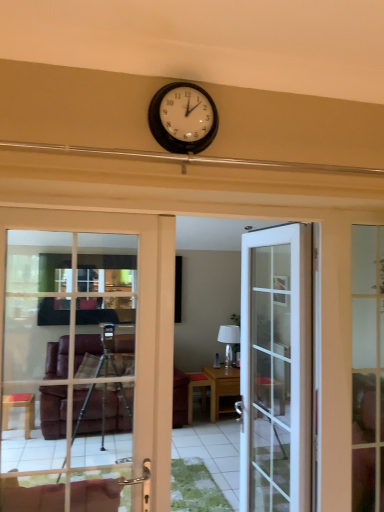
Locate an element on the screen. Image resolution: width=384 pixels, height=512 pixels. matte glass door at right is located at coordinates (367, 368).

I want to click on matte black clock at upper center, so click(183, 118).

Find the location of `wooden table at center, the 1th table from the right`. wooden table at center, the 1th table from the right is located at coordinates (222, 387).

The image size is (384, 512). What are the coordinates of `white glossy lamp at center` in the screenshot? It's located at (229, 340).

Considering the relative positions of white glossy lamp at center and wooden table at center, which appears as the first table when viewed from the left, in the image provided, is white glossy lamp at center in front of wooden table at center, which appears as the first table when viewed from the left,?

That is False.

Locate an element on the screen. lamp behind the wooden table at center, placed as the second table when sorted from right to left is located at coordinates (229, 340).

Can you confirm if white glossy lamp at center is shorter than wooden table at center, which appears as the first table when viewed from the left?

In fact, white glossy lamp at center may be taller than wooden table at center, which appears as the first table when viewed from the left.

In terms of width, does white glossy lamp at center look wider or thinner when compared to wooden table at center, which appears as the first table when viewed from the left?

In the image, white glossy lamp at center appears to be more narrow than wooden table at center, which appears as the first table when viewed from the left.

Could you tell me if white glass door at center, which is the 2th door from left to right, is facing white glossy lamp at center?

No, white glass door at center, which is the 2th door from left to right, does not turn towards white glossy lamp at center.

Between white glass door at center, which is the 1th door in back-to-front order, and white glossy lamp at center, which one appears on the right side from the viewer's perspective?

From the viewer's perspective, white glossy lamp at center appears more on the right side.

Between white glass door at center, which is the 2th door from left to right, and white glossy lamp at center, which one has more height?

white glass door at center, which is the 2th door from left to right, is taller.

Is point (274, 263) behind point (229, 366)?

No, it is not.

Could you tell me if white glossy lamp at center is facing matte black clock at upper center?

No, white glossy lamp at center does not turn towards matte black clock at upper center.

Considering the sizes of white glossy lamp at center and matte black clock at upper center in the image, is white glossy lamp at center taller or shorter than matte black clock at upper center?

Considering their sizes, white glossy lamp at center has more height than matte black clock at upper center.

Is white glossy lamp at center positioned behind matte black clock at upper center?

Yes, white glossy lamp at center is behind matte black clock at upper center.

How far apart are white glass door at center, which is the 1th door in back-to-front order, and matte black clock at upper center?

white glass door at center, which is the 1th door in back-to-front order, is 1.21 meters away from matte black clock at upper center.

Is white glass door at center, the 2th door viewed from the front, to the left of matte black clock at upper center from the viewer's perspective?

No, white glass door at center, the 2th door viewed from the front, is not to the left of matte black clock at upper center.

Considering the positions of objects white glass door at center, which is counted as the 1th door, starting from the right, and matte black clock at upper center in the image provided, who is behind, white glass door at center, which is counted as the 1th door, starting from the right, or matte black clock at upper center?

white glass door at center, which is counted as the 1th door, starting from the right.

Is matte black clock at upper center at the back of white glass door at center, the 2th door viewed from the front?

That's not correct — white glass door at center, the 2th door viewed from the front, is not looking away from matte black clock at upper center.

Considering the relative positions of matte black clock at upper center and white glass door at center, which is the 2th door from left to right, in the image provided, is matte black clock at upper center to the left or to the right of white glass door at center, which is the 2th door from left to right,?

matte black clock at upper center is to the left of white glass door at center, which is the 2th door from left to right.

Looking at their sizes, would you say matte black clock at upper center is wider or thinner than white glass door at center, which is the 2th door from left to right?

Considering their sizes, matte black clock at upper center looks slimmer than white glass door at center, which is the 2th door from left to right.

Is white glass door at center, which is the 2th door from left to right, completely or partially inside matte black clock at upper center?

No, white glass door at center, which is the 2th door from left to right, is not a part of matte black clock at upper center.

Identify the location of lamp that appears on the right of matte black clock at upper center. (229, 340).

Is matte black clock at upper center wider than white glossy lamp at center?

No.

Considering the points (202, 109) and (230, 355), which point is in front, point (202, 109) or point (230, 355)?

Point (202, 109)

Would you say wooden table at center, placed as the second table when sorted from right to left, is outside matte black clock at upper center?

Yes.

Can you confirm if wooden table at center, placed as the second table when sorted from right to left, is positioned to the right of matte black clock at upper center?

Yes.

Considering the sizes of objects wooden table at center, placed as the second table when sorted from right to left, and matte black clock at upper center in the image provided, who is smaller, wooden table at center, placed as the second table when sorted from right to left, or matte black clock at upper center?

matte black clock at upper center is smaller.

From the image's perspective, between wooden table at center, placed as the second table when sorted from right to left, and matte black clock at upper center, which one is located above?

matte black clock at upper center appears higher in the image.

This screenshot has height=512, width=384. I want to click on table that is the 2nd one when counting leftward from the white glossy lamp at center, so click(201, 393).

The width and height of the screenshot is (384, 512). In order to click on lamp that appears below the white glass door at center, which is counted as the 1th door, starting from the right (from the image's perspective) in this screenshot , I will do [x=229, y=340].

Consider the image. Estimate the real-world distances between objects in this image. Which object is further from white glossy lamp at center, wooden table at center, which appears as the first table when viewed from the left, or wooden table at center, positioned as the second table in left-to-right order?

The object further to white glossy lamp at center is wooden table at center, which appears as the first table when viewed from the left.

When comparing their distances from matte black clock at upper center, does white glass door at center, which is the 2th door from left to right, or white glass door at left, which is the second door in back-to-front order, seem closer?

The object closer to matte black clock at upper center is white glass door at left, which is the second door in back-to-front order.

Looking at the image, which one is located further to wooden table at center, placed as the second table when sorted from right to left, wooden table at center, the 1th table from the right, or white glossy lamp at center?

white glossy lamp at center is positioned further to the anchor wooden table at center, placed as the second table when sorted from right to left.

Which object lies nearer to the anchor point matte glass door at right, white glass door at center, which is counted as the 1th door, starting from the right, or wooden table at center, positioned as the second table in left-to-right order?

white glass door at center, which is counted as the 1th door, starting from the right, lies closer to matte glass door at right than the other object.

Considering their positions, is white glossy lamp at center positioned closer to wooden table at center, placed as the second table when sorted from right to left, than matte glass door at right?

The object closer to wooden table at center, placed as the second table when sorted from right to left, is white glossy lamp at center.

Considering their positions, is matte glass door at right positioned closer to white glass door at left, acting as the 1th door starting from the front, than white glossy lamp at center?

Among the two, matte glass door at right is located nearer to white glass door at left, acting as the 1th door starting from the front.

Looking at the image, which one is located closer to matte glass door at right, white glossy lamp at center or white glass door at center, the 2th door viewed from the front?

Among the two, white glass door at center, the 2th door viewed from the front, is located nearer to matte glass door at right.

From the image, which object appears to be nearer to white glass door at left, the second door positioned from the right, wooden table at center, positioned as the second table in left-to-right order, or white glass door at center, the 2th door viewed from the front?

white glass door at center, the 2th door viewed from the front, lies closer to white glass door at left, the second door positioned from the right, than the other object.

This screenshot has height=512, width=384. What are the coordinates of `door between matte black clock at upper center and white glass door at center, which is the 2th door from left to right, in the vertical direction` in the screenshot? It's located at (136, 325).

Image resolution: width=384 pixels, height=512 pixels. I want to click on window frame between matte black clock at upper center and white glass door at center, the 2th door viewed from the front, vertically, so tap(367, 368).

Locate an element on the screen. The image size is (384, 512). door positioned between matte glass door at right and wooden table at center, the 1th table from the right, from near to far is located at coordinates (276, 369).

Image resolution: width=384 pixels, height=512 pixels. What are the coordinates of `window frame between white glass door at left, which is the first door in left-to-right order, and wooden table at center, the 1th table from the right, from front to back` in the screenshot? It's located at (367, 368).